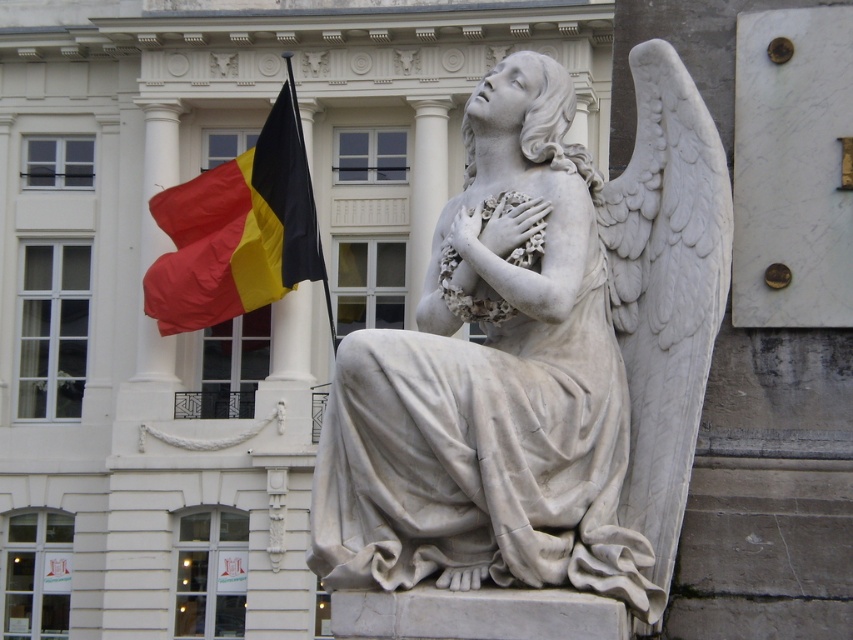
Question: Can you confirm if white marble angel at center is wider than red/yellow/black fabric flag at upper left?

Choices:
 (A) yes
 (B) no

Answer: (B)

Question: Observing the image, what is the correct spatial positioning of white marble angel at center in reference to red/yellow/black fabric flag at upper left?

Choices:
 (A) below
 (B) above

Answer: (A)

Question: Which point appears farthest from the camera in this image?

Choices:
 (A) (289, 220)
 (B) (492, 515)

Answer: (A)

Question: Can you confirm if white marble angel at center is positioned to the left of red/yellow/black fabric flag at upper left?

Choices:
 (A) yes
 (B) no

Answer: (B)

Question: Which point appears closest to the camera in this image?

Choices:
 (A) (213, 276)
 (B) (354, 522)

Answer: (B)

Question: Which object appears closest to the camera in this image?

Choices:
 (A) white marble angel at center
 (B) red/yellow/black fabric flag at upper left

Answer: (A)